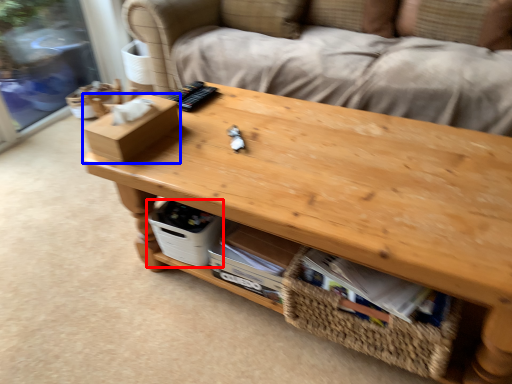
Question: Which of the following is the closest to the observer, storage box (highlighted by a red box) or box (highlighted by a blue box)?

Choices:
 (A) storage box
 (B) box

Answer: (B)